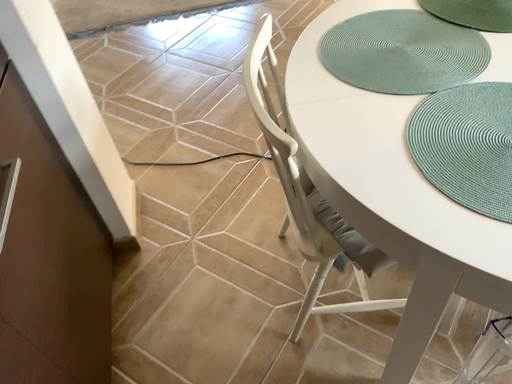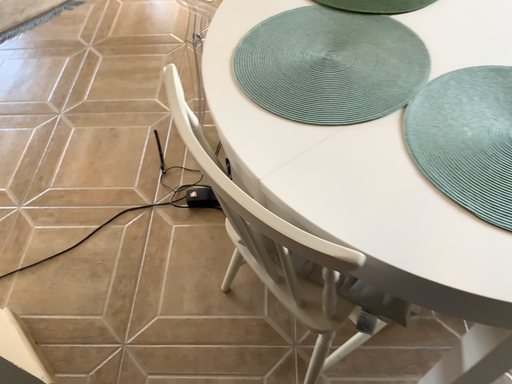
Question: Which way did the camera rotate in the video?

Choices:
 (A) rotated left
 (B) rotated right

Answer: (B)